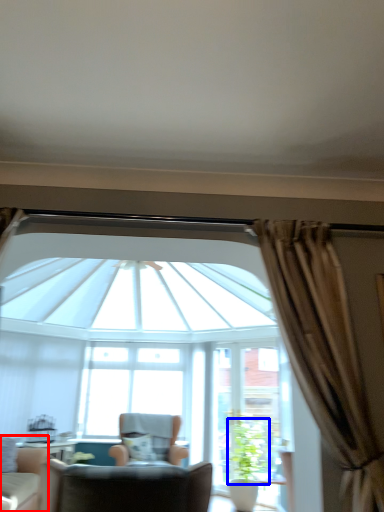
Question: Which object appears closest to the camera in this image, chair (highlighted by a red box) or plant (highlighted by a blue box)?

Choices:
 (A) chair
 (B) plant

Answer: (A)